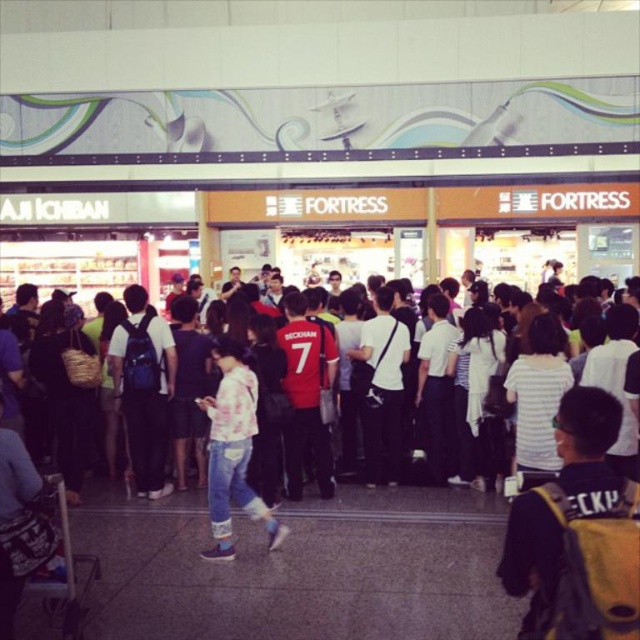
You are trying to decide between buying the white cotton shirt at center and the white matte shirt at center. Which one is located to the right of the other?

The white cotton shirt at center is positioned on the right side of white matte shirt at center.

You are standing in the shopping mall and need to reach a specific location. You have two points marked in the scene, point 1 at coordinates (573, 634) and point 2 at coordinates (221, 336). Which point is closer to you?

Point 1 at coordinates (573, 634) is closer to the viewer than point 2 at coordinates (221, 336).